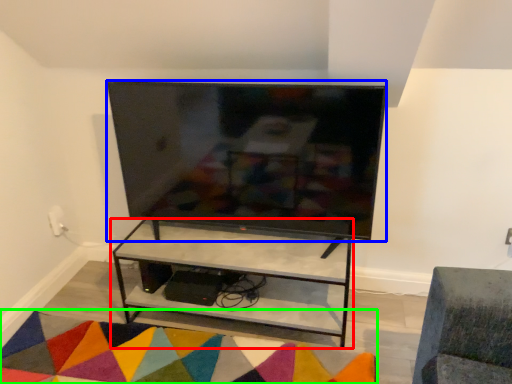
Question: Which object is the farthest from shelf (highlighted by a red box)? Choose among these: television (highlighted by a blue box) or mat (highlighted by a green box).

Choices:
 (A) television
 (B) mat

Answer: (A)